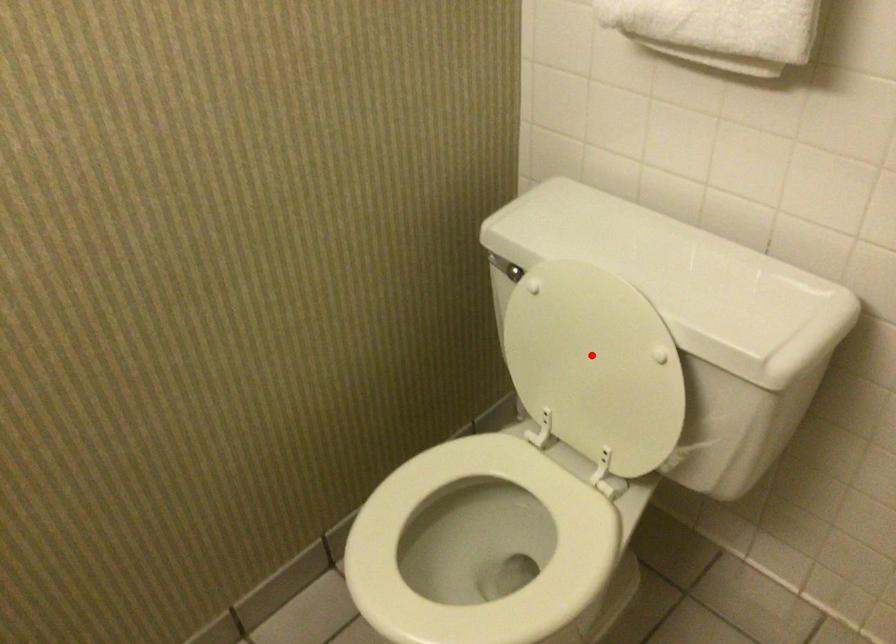
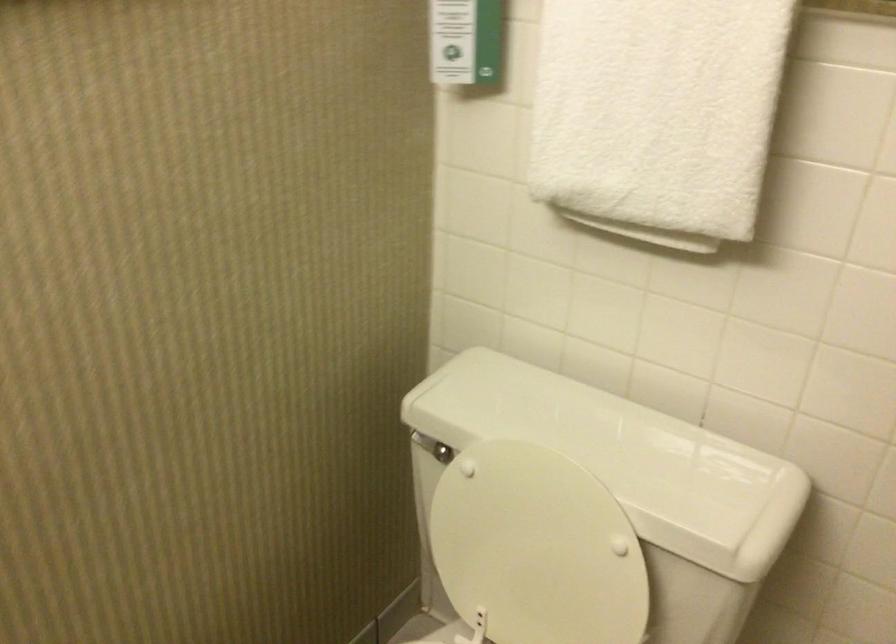
Question: I am providing you with two images of the same scene from different viewpoints. Given a red point in image1, look at the same physical point in image2. Is it:

Choices:
 (A) Closer to the viewpoint
 (B) Farther from the viewpoint

Answer: (A)